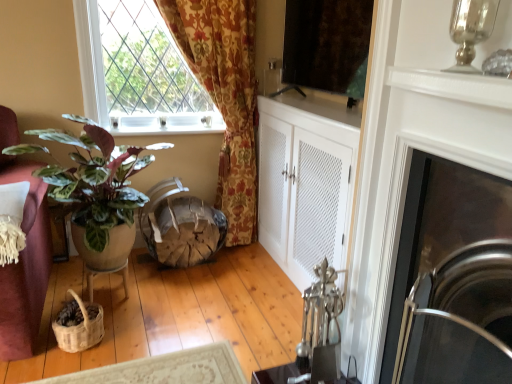
Question: Does point (362, 64) appear closer or farther from the camera than point (124, 279)?

Choices:
 (A) farther
 (B) closer

Answer: (B)

Question: From the image's perspective, is matte black screen at upper center located above or below wooden table at lower left?

Choices:
 (A) below
 (B) above

Answer: (B)

Question: Which object is positioned closest to the wooden table at lower left?

Choices:
 (A) wooden textured swivel chair at center
 (B) matte black screen at upper center
 (C) polished stainless steel fireplace at right
 (D) matte terracotta pot at left

Answer: (A)

Question: Which object is positioned farthest from the matte terracotta pot at left?

Choices:
 (A) matte black screen at upper center
 (B) wooden table at lower left
 (C) polished stainless steel fireplace at right
 (D) wooden textured swivel chair at center

Answer: (C)